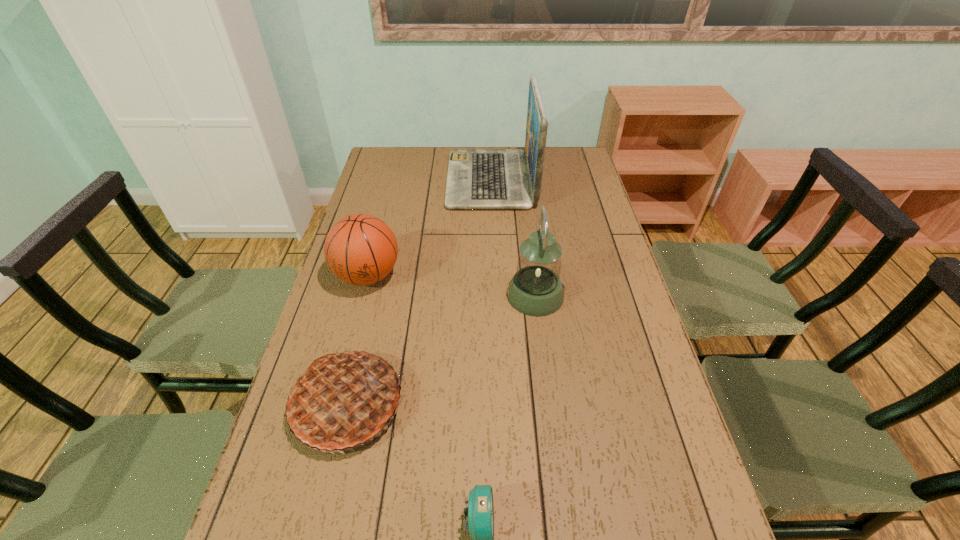
The width and height of the screenshot is (960, 540). Find the location of `object that is at the far edge`. object that is at the far edge is located at coordinates (477, 178).

Image resolution: width=960 pixels, height=540 pixels. Find the location of `basketball that is positioned at the left edge`. basketball that is positioned at the left edge is located at coordinates (360, 249).

Find the location of `pie that is positioned at the left edge`. pie that is positioned at the left edge is located at coordinates (345, 399).

In the image, there is a desktop. Identify the location of vacant space at the left edge. (396, 205).

The height and width of the screenshot is (540, 960). I want to click on vacant space at the right edge, so click(600, 245).

Image resolution: width=960 pixels, height=540 pixels. Identify the location of vacant space at the far right corner. (583, 174).

This screenshot has height=540, width=960. In order to click on blank region between the second nearest object and the lantern in this screenshot , I will do `click(442, 350)`.

Find the location of a particular element. The height and width of the screenshot is (540, 960). free space between the farthest object and the basketball is located at coordinates [x=429, y=228].

Identify which object is the closest to the pie. Please provide its 2D coordinates. Your answer should be formatted as a tuple, i.e. [(x, y)], where the tuple contains the x and y coordinates of a point satisfying the conditions above.

[(481, 513)]

Locate which object ranks second in proximity to the shortest object. Please provide its 2D coordinates. Your answer should be formatted as a tuple, i.e. [(x, y)], where the tuple contains the x and y coordinates of a point satisfying the conditions above.

[(536, 290)]